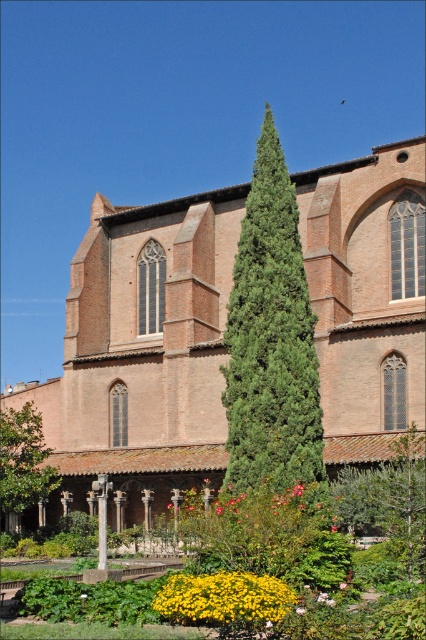
You are a gardener standing at the point labeled point (224, 598). Which object are you standing on?

You are standing on the yellow matte flower at lower center because the point (224, 598) is located on it.

You are a gardener standing in front of the historic brick building and looking at the yellow matte flower at lower center and the green leafy tree at lower left. Which object is nearer to you?

The yellow matte flower at lower center is closer to the viewer than the green leafy tree at lower left.

You are standing in the garden in front of the historic brick building. There is a point marked at coordinates (143, 352). What does this point indicate?

The point at coordinates (143, 352) indicates the brick wall church at center.